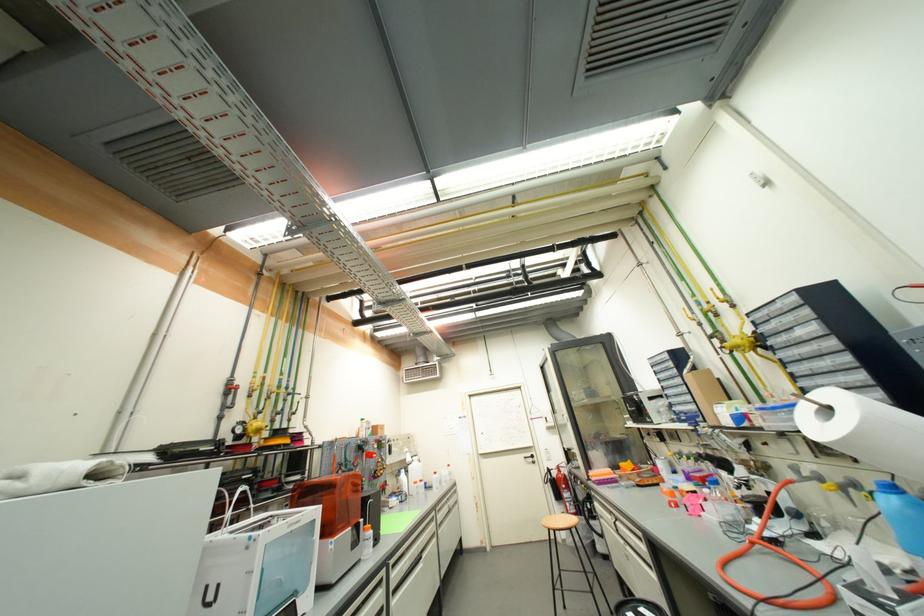
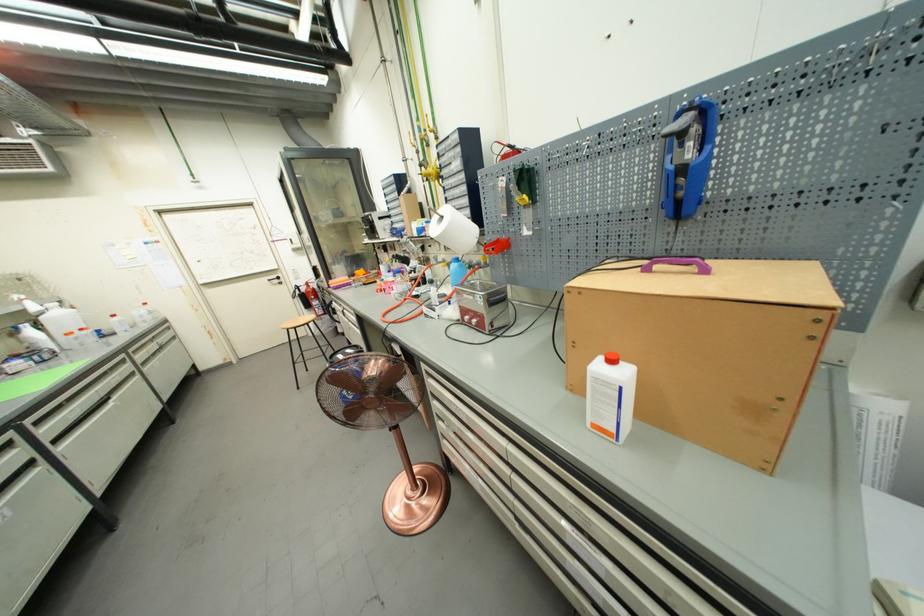
The point at (530, 459) is marked in the first image. Where is the corresponding point in the second image?

(274, 282)